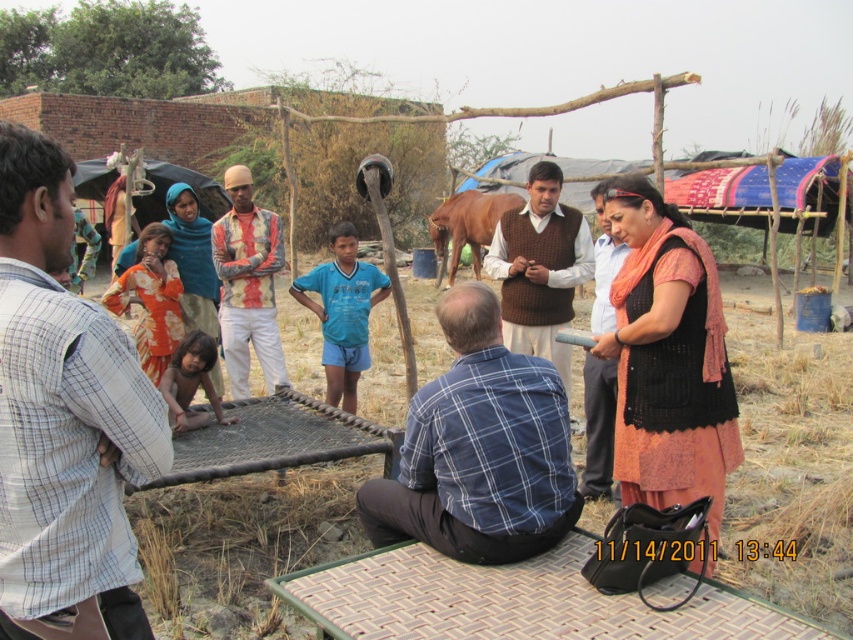
Can you confirm if printed cotton shirt at center is thinner than brown leather horse at center?

Indeed, printed cotton shirt at center has a lesser width compared to brown leather horse at center.

Can you confirm if printed cotton shirt at center is smaller than brown leather horse at center?

Correct, printed cotton shirt at center occupies less space than brown leather horse at center.

Is point (228, 307) positioned before point (514, 193)?

Yes, point (228, 307) is closer to viewer.

Find the location of `printed cotton shirt at center`. printed cotton shirt at center is located at coordinates (247, 284).

Does printed cotton shirt at center appear over orange floral dress at left?

Yes, printed cotton shirt at center is above orange floral dress at left.

Who is lower down, printed cotton shirt at center or orange floral dress at left?

orange floral dress at left

Where is `printed cotton shirt at center`? printed cotton shirt at center is located at coordinates (247, 284).

Is white checkered shirt at left closer to camera compared to printed cotton shirt at center?

Yes, it is.

Who is lower down, white checkered shirt at left or printed cotton shirt at center?

Positioned lower is white checkered shirt at left.

Between point (7, 486) and point (265, 234), which one is positioned behind?

The point (265, 234) is more distant.

Find the location of `white checkered shirt at left`. white checkered shirt at left is located at coordinates (64, 420).